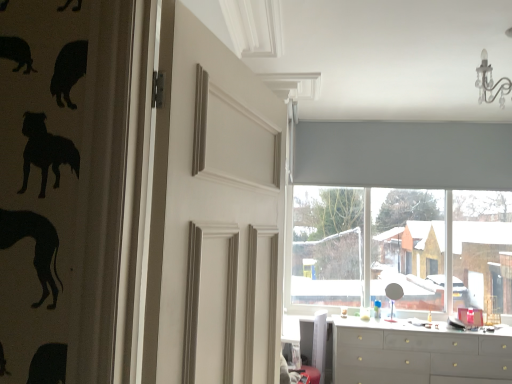
Question: Is gray fabric curtain at upper center smaller than white matte door at center?

Choices:
 (A) yes
 (B) no

Answer: (A)

Question: Is gray fabric curtain at upper center with white matte door at center?

Choices:
 (A) yes
 (B) no

Answer: (B)

Question: Is gray fabric curtain at upper center outside of white matte door at center?

Choices:
 (A) yes
 (B) no

Answer: (A)

Question: Is the position of gray fabric curtain at upper center more distant than that of white matte door at center?

Choices:
 (A) yes
 (B) no

Answer: (A)

Question: Is white matte door at center at the back of gray fabric curtain at upper center?

Choices:
 (A) yes
 (B) no

Answer: (B)

Question: Could you tell me if gray fabric curtain at upper center is turned towards white matte door at center?

Choices:
 (A) no
 (B) yes

Answer: (B)

Question: Is matte gray dresser at lower right oriented towards white glossy counter top at lower center?

Choices:
 (A) no
 (B) yes

Answer: (A)

Question: Is white glossy counter top at lower center a part of matte gray dresser at lower right?

Choices:
 (A) yes
 (B) no

Answer: (B)

Question: Is the surface of matte gray dresser at lower right in direct contact with white glossy counter top at lower center?

Choices:
 (A) yes
 (B) no

Answer: (B)

Question: Is matte gray dresser at lower right outside of white glossy counter top at lower center?

Choices:
 (A) no
 (B) yes

Answer: (B)

Question: From the image's perspective, is matte gray dresser at lower right on white glossy counter top at lower center?

Choices:
 (A) no
 (B) yes

Answer: (A)

Question: Is matte gray dresser at lower right turned away from white glossy counter top at lower center?

Choices:
 (A) no
 (B) yes

Answer: (B)

Question: From the image's perspective, does matte gray roller blind at upper center appear higher than white matte door at center?

Choices:
 (A) no
 (B) yes

Answer: (A)